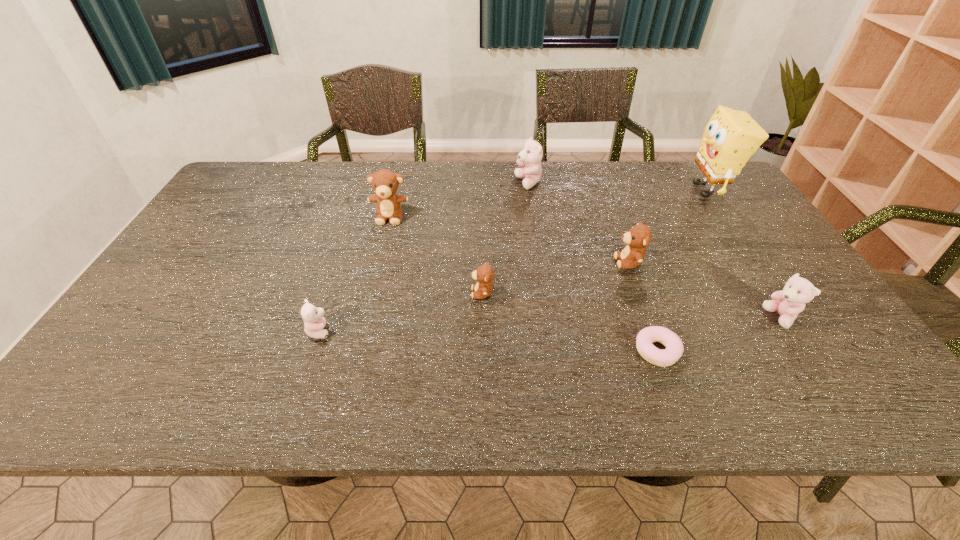
The image size is (960, 540). What are the coordinates of `free spot that satisfies the following two spatial constraints: 1. on the face of the doughnut; 2. on the left side of the nearest brown teddy bear` in the screenshot? It's located at pyautogui.click(x=483, y=351).